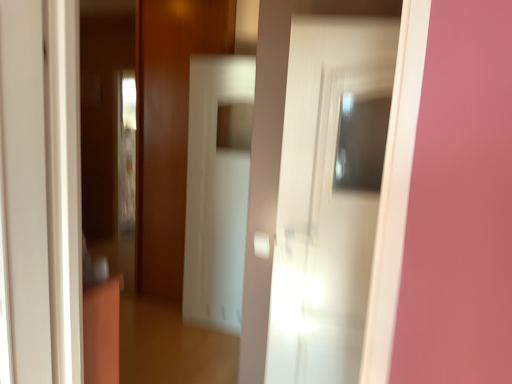
Question: From the image's perspective, is white glossy door at left, which is the 1th door from left to right, located beneath white glossy door at center, acting as the second door starting from the left?

Choices:
 (A) yes
 (B) no

Answer: (B)

Question: Is white glossy door at left, the 1th door viewed from the front, positioned with its back to white glossy door at center, the 1th door from the back?

Choices:
 (A) no
 (B) yes

Answer: (A)

Question: Is the position of white glossy door at left, the 1th door viewed from the front, less distant than that of white glossy door at center, placed as the 2th door when sorted from front to back?

Choices:
 (A) no
 (B) yes

Answer: (B)

Question: Does white glossy door at left, which is the 1th door from left to right, lie behind white glossy door at center, placed as the 2th door when sorted from front to back?

Choices:
 (A) yes
 (B) no

Answer: (B)

Question: Considering the relative sizes of white glossy door at left, the second door viewed from the right, and white glossy door at center, the 1th door from the back, in the image provided, is white glossy door at left, the second door viewed from the right, bigger than white glossy door at center, the 1th door from the back,?

Choices:
 (A) yes
 (B) no

Answer: (B)

Question: In the image, is white glossy screen door at center on the left side or the right side of white glossy door at center, arranged as the first door when viewed from the right?

Choices:
 (A) right
 (B) left

Answer: (B)

Question: From the image's perspective, relative to white glossy door at center, the 1th door from the back, is white glossy screen door at center above or below?

Choices:
 (A) above
 (B) below

Answer: (A)

Question: Is point (224, 304) closer or farther from the camera than point (307, 357)?

Choices:
 (A) farther
 (B) closer

Answer: (A)

Question: Based on their sizes in the image, would you say white glossy screen door at center is bigger or smaller than white glossy door at center, the 1th door from the back?

Choices:
 (A) small
 (B) big

Answer: (B)

Question: Is point (286, 306) closer or farther from the camera than point (207, 132)?

Choices:
 (A) farther
 (B) closer

Answer: (B)

Question: Relative to white glossy screen door at center, is white glossy door at center, placed as the 2th door when sorted from front to back, in front or behind?

Choices:
 (A) behind
 (B) front

Answer: (B)

Question: From the image's perspective, relative to white glossy screen door at center, is white glossy door at center, placed as the 2th door when sorted from front to back, above or below?

Choices:
 (A) above
 (B) below

Answer: (B)

Question: Considering the positions of white glossy door at center, placed as the 2th door when sorted from front to back, and white glossy screen door at center in the image, is white glossy door at center, placed as the 2th door when sorted from front to back, taller or shorter than white glossy screen door at center?

Choices:
 (A) short
 (B) tall

Answer: (A)

Question: From a real-world perspective, is white glossy door at left, the second door viewed from the right, above or below white glossy screen door at center?

Choices:
 (A) above
 (B) below

Answer: (A)

Question: In terms of size, does white glossy door at left, which is counted as the second door, starting from the back, appear bigger or smaller than white glossy screen door at center?

Choices:
 (A) big
 (B) small

Answer: (B)